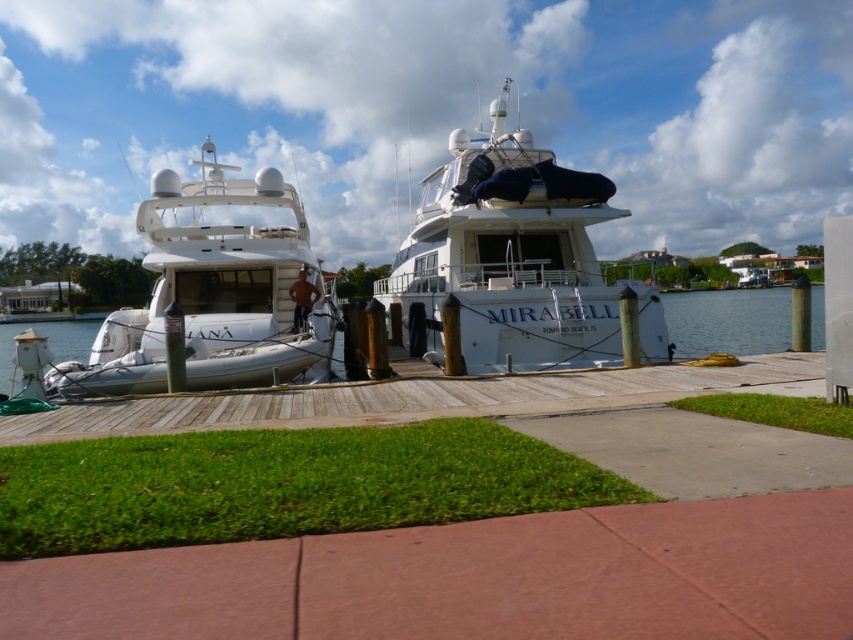
Where is `white glossy boat at center`? white glossy boat at center is located at coordinates (515, 257).

Between point (608, 358) and point (643, 396), which one is positioned in front?

Point (643, 396) is more forward.

Where is `white glossy boat at center`? The image size is (853, 640). white glossy boat at center is located at coordinates tap(515, 257).

Is white glossy yacht at center wider than wooden dock at center?

Correct, the width of white glossy yacht at center exceeds that of wooden dock at center.

Which is above, white glossy yacht at center or wooden dock at center?

white glossy yacht at center is higher up.

Find the location of a particular element. white glossy yacht at center is located at coordinates (213, 292).

Between white glossy boat at center and white glossy yacht at center, which one has less height?

Standing shorter between the two is white glossy yacht at center.

Does white glossy boat at center appear on the left side of white glossy yacht at center?

In fact, white glossy boat at center is to the right of white glossy yacht at center.

Is point (492, 298) behind point (265, 195)?

No, it is in front of (265, 195).

The image size is (853, 640). In order to click on white glossy boat at center in this screenshot , I will do `click(515, 257)`.